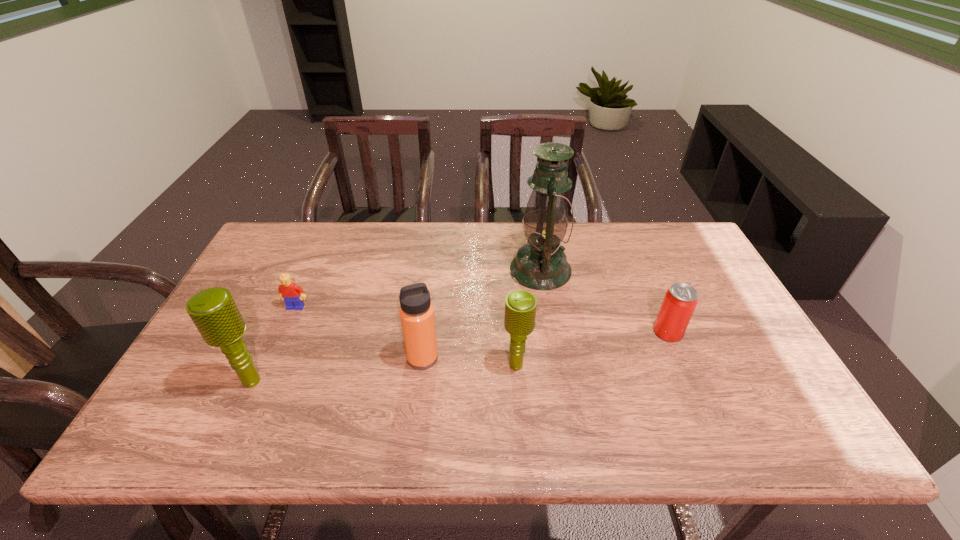
In the image, there is a desktop. In order to click on vacant area at the near edge in this screenshot , I will do `click(590, 390)`.

The width and height of the screenshot is (960, 540). I want to click on vacant space at the left edge of the desktop, so click(x=272, y=306).

The image size is (960, 540). Identify the location of vacant space at the right edge of the desktop. (776, 374).

In the image, there is a desktop. Where is `free space at the far left corner`? This screenshot has height=540, width=960. free space at the far left corner is located at coordinates (293, 253).

This screenshot has width=960, height=540. In the image, there is a desktop. In order to click on vacant area at the far right corner in this screenshot , I will do coord(680,237).

At what (x,y) coordinates should I click in order to perform the action: click on vacant space at the near right corner of the desktop. Please return your answer as a coordinate pair (x, y). The width and height of the screenshot is (960, 540). Looking at the image, I should click on (749, 402).

Locate an element on the screen. The width and height of the screenshot is (960, 540). free space between the third farthest object and the taller microphone is located at coordinates tap(460, 356).

The image size is (960, 540). In order to click on free space between the rightmost object and the right microphone in this screenshot , I will do `click(592, 349)`.

The width and height of the screenshot is (960, 540). Identify the location of vacant area that lies between the can and the farthest object. (604, 301).

At what (x,y) coordinates should I click in order to perform the action: click on vacant space that is in between the third farthest object and the farthest object. Please return your answer as a coordinate pair (x, y). The width and height of the screenshot is (960, 540). Looking at the image, I should click on (604, 301).